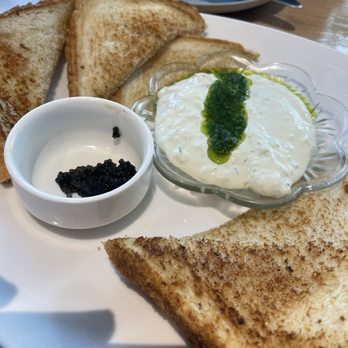
Find the location of a particular element. crumb on tabletop is located at coordinates (98, 247).